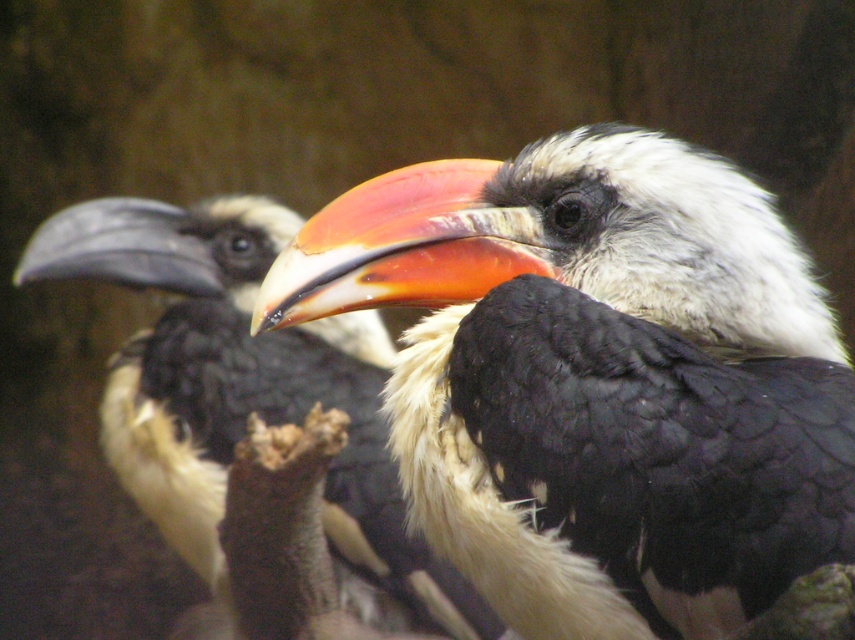
Question: Which object appears farthest from the camera in this image?

Choices:
 (A) white matte beak at center
 (B) white feathered bird at left

Answer: (B)

Question: Is white matte beak at center behind white feathered bird at left?

Choices:
 (A) no
 (B) yes

Answer: (A)

Question: Does white matte beak at center come behind white feathered bird at left?

Choices:
 (A) no
 (B) yes

Answer: (A)

Question: Which of the following is the farthest from the observer?

Choices:
 (A) white feathered bird at left
 (B) white matte beak at center

Answer: (A)

Question: Does white matte beak at center have a lesser width compared to white feathered bird at left?

Choices:
 (A) yes
 (B) no

Answer: (A)